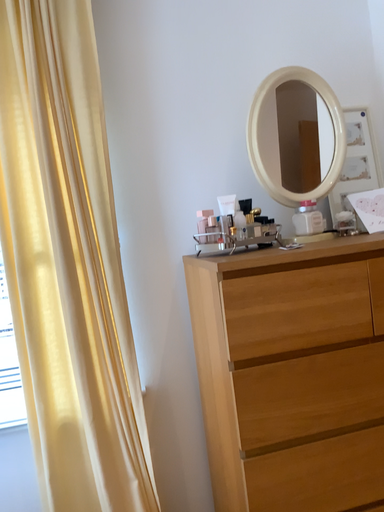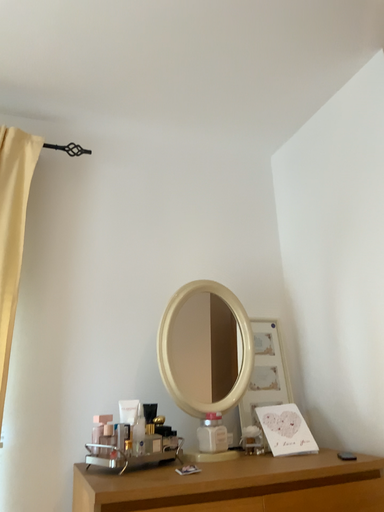
Question: How did the camera likely rotate when shooting the video?

Choices:
 (A) rotated left
 (B) rotated right

Answer: (B)